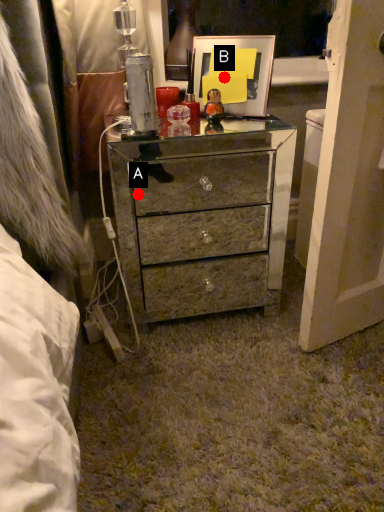
Question: Two points are circled on the image, labeled by A and B beside each circle. Which point appears closest to the camera in this image?

Choices:
 (A) A is closer
 (B) B is closer

Answer: (B)